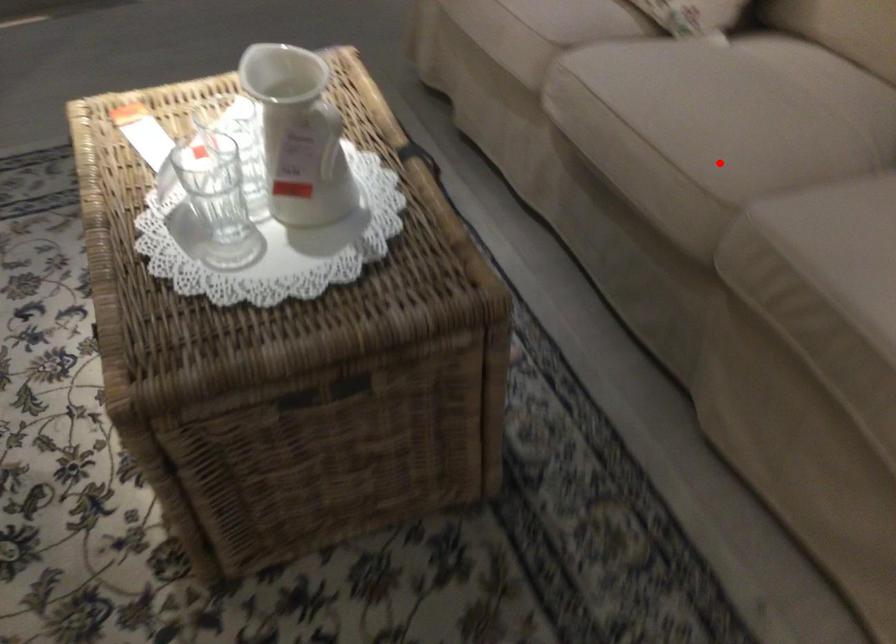
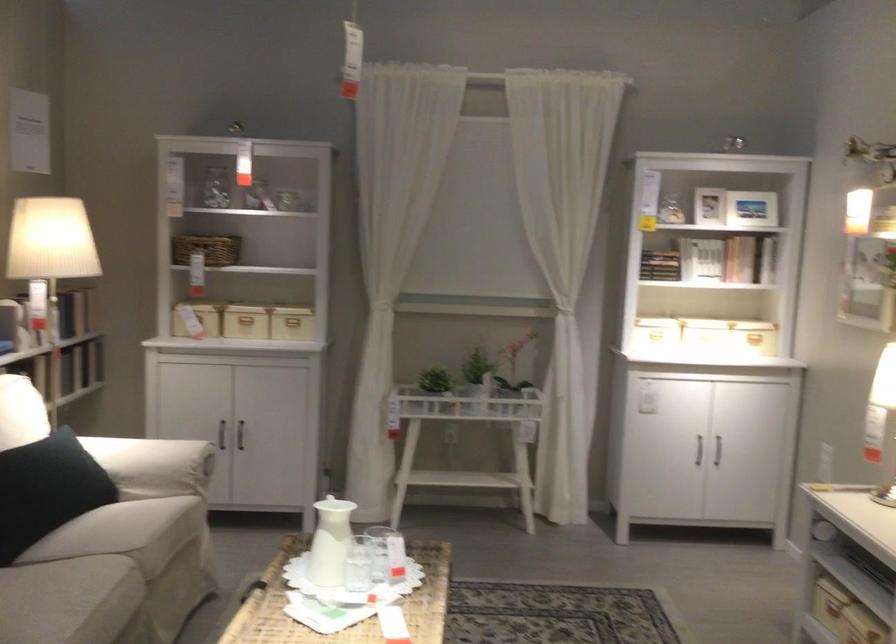
In the second image, find the point that corresponds to the highlighted location in the first image.

(110, 576)